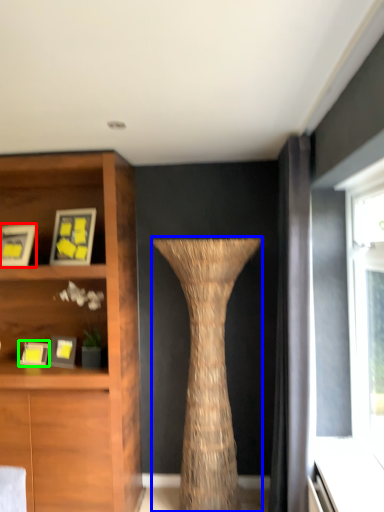
Question: Which is nearer to the picture frame (highlighted by a red box)? vase (highlighted by a blue box) or picture frame (highlighted by a green box).

Choices:
 (A) vase
 (B) picture frame

Answer: (B)